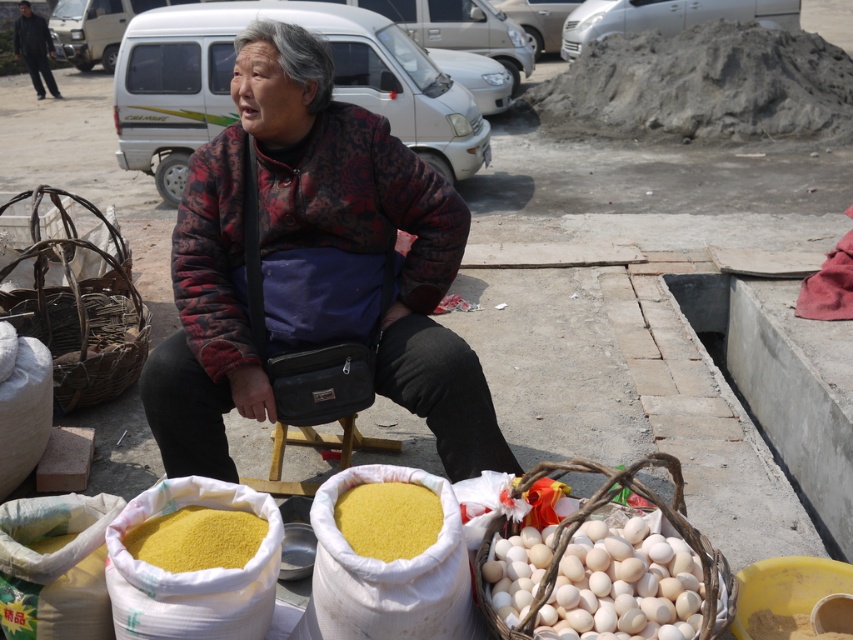
Between point (392, 508) and point (489, 616), which one is positioned behind?

Positioned behind is point (489, 616).

Can you confirm if yellow powder at lower center is positioned to the right of woven brown basket at lower right?

In fact, yellow powder at lower center is to the left of woven brown basket at lower right.

At what (x,y) coordinates should I click in order to perform the action: click on yellow powder at lower center. Please return your answer as a coordinate pair (x, y). The image size is (853, 640). Looking at the image, I should click on (387, 518).

Does point (393, 259) lie behind point (38, 336)?

No, (393, 259) is in front of (38, 336).

Is patterned fabric jacket at center thinner than woven brown basket at left?

Yes.

Where is `patterned fabric jacket at center`? This screenshot has height=640, width=853. patterned fabric jacket at center is located at coordinates (312, 266).

Is woven brown basket at left shorter than yellow powder at lower center?

No.

Does woven brown basket at left have a smaller size compared to yellow powder at lower center?

No.

You are a GUI agent. You are given a task and a screenshot of the screen. Output one action in this format:
    pyautogui.click(x=<x>, y=<y>)
    Task: Click on the woven brown basket at left
    The image size is (853, 640).
    Given the screenshot: What is the action you would take?
    pyautogui.click(x=79, y=308)

The height and width of the screenshot is (640, 853). I want to click on woven brown basket at left, so click(79, 308).